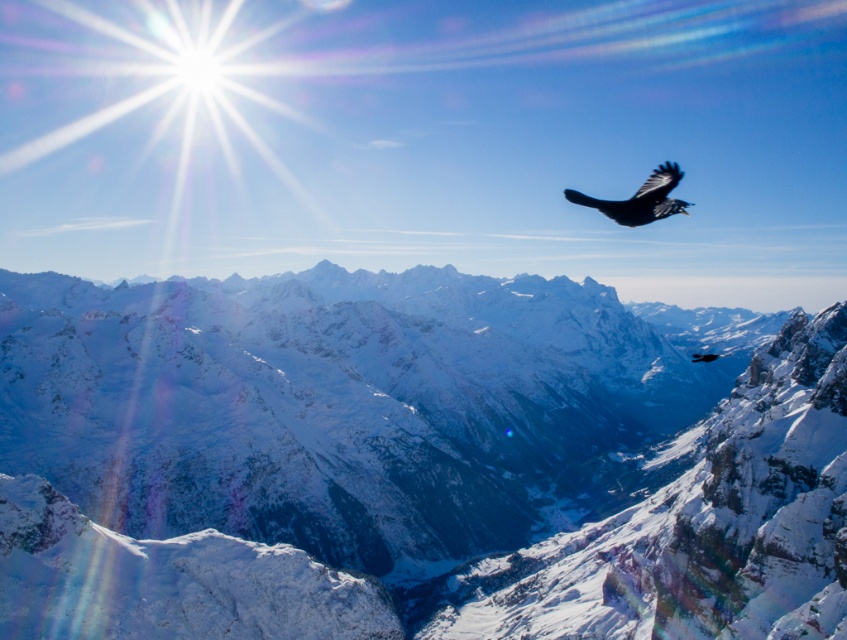
Based on the provided image, what are the coordinates of the snowy granite mountain range at center?

The snowy granite mountain range at center is located at coordinates (410,461).

You are an explorer navigating a mountainous landscape. You see two points marked on your map at coordinates point [309,497] and point [646,192]. Which point is closer to your current position if you are standing at the base of the mountain facing the peaks?

Point [646,192] is closer to your current position because it is in front of point [309,497], which is behind it.